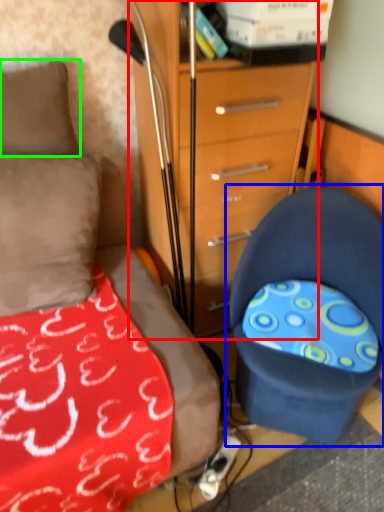
Question: Which object is positioned closest to chest of drawers (highlighted by a red box)? Select from chair (highlighted by a blue box) and pillow (highlighted by a green box).

Choices:
 (A) chair
 (B) pillow

Answer: (A)